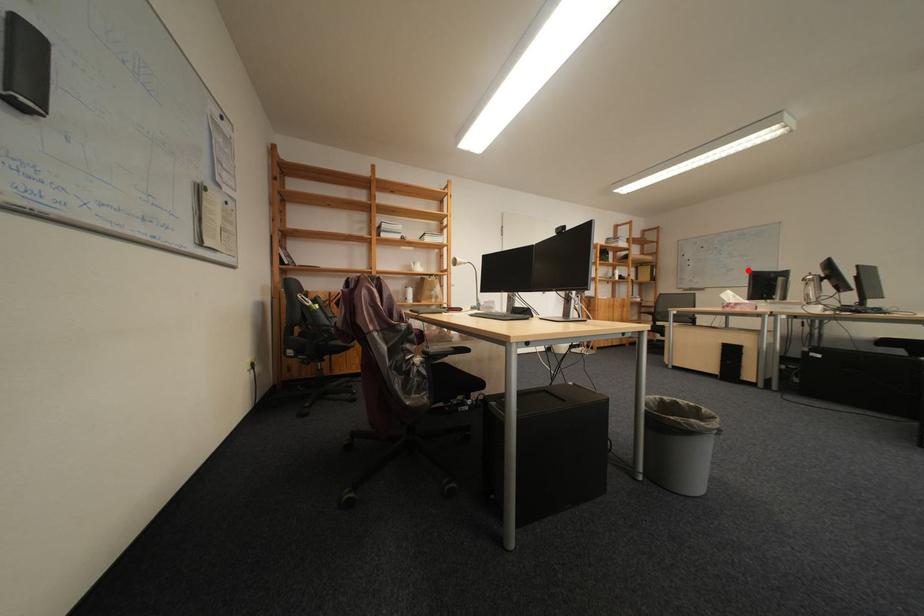
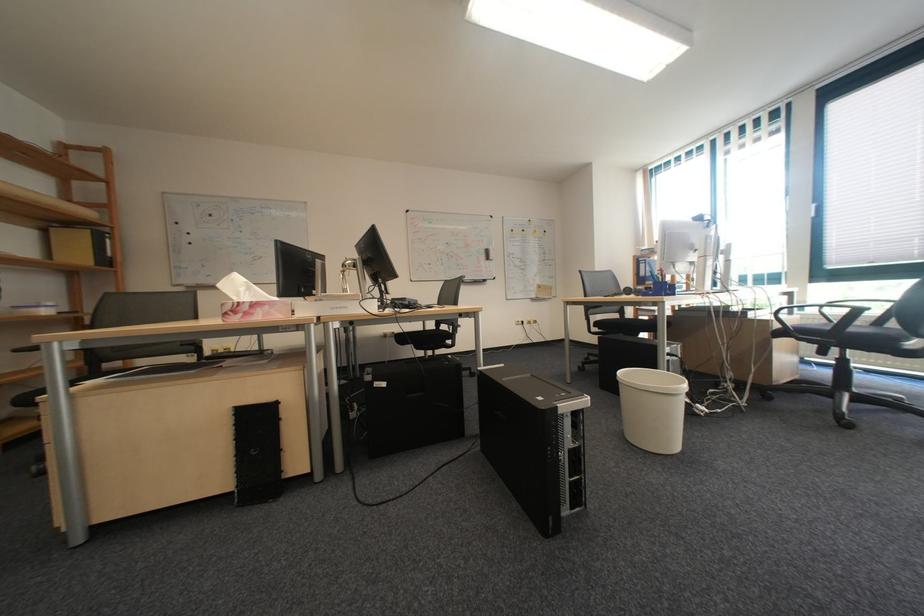
Question: I am providing you with two images of the same scene from different viewpoints. A red point is marked on the first image. Can you still see the location of the red point in image 2?

Choices:
 (A) Yes
 (B) No

Answer: (A)